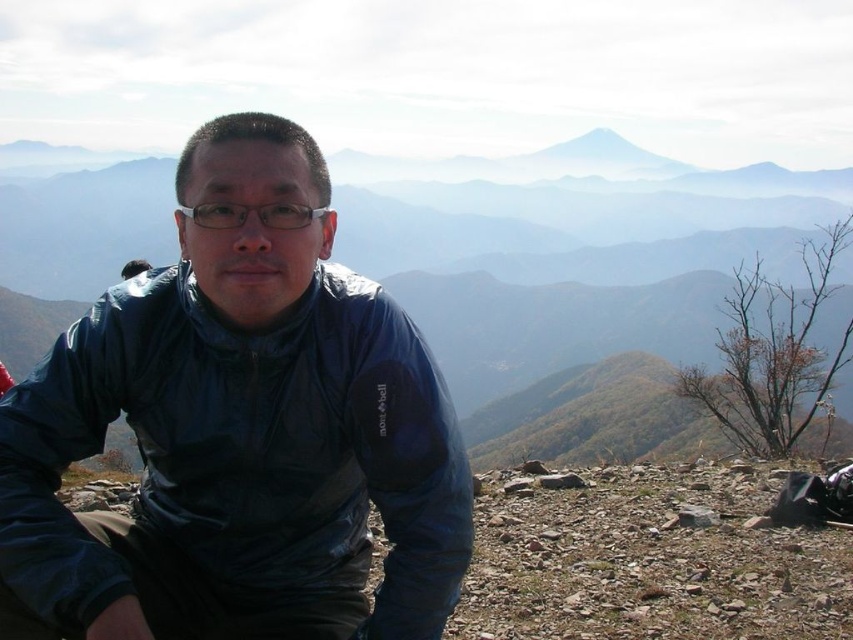
Question: Is matte blue jacket at center thinner than transparent plastic glasses at center?

Choices:
 (A) yes
 (B) no

Answer: (B)

Question: Which object is farther from the camera taking this photo?

Choices:
 (A) matte blue jacket at center
 (B) transparent plastic glasses at center

Answer: (B)

Question: Which point appears closest to the camera in this image?

Choices:
 (A) (361, 365)
 (B) (280, 211)

Answer: (B)

Question: Which point is farther to the camera?

Choices:
 (A) (194, 188)
 (B) (207, 209)

Answer: (A)

Question: Does matte blue jacket at center have a smaller size compared to transparent plastic glasses at center?

Choices:
 (A) no
 (B) yes

Answer: (A)

Question: Does matte blue jacket at center appear under transparent plastic glasses at center?

Choices:
 (A) yes
 (B) no

Answer: (A)